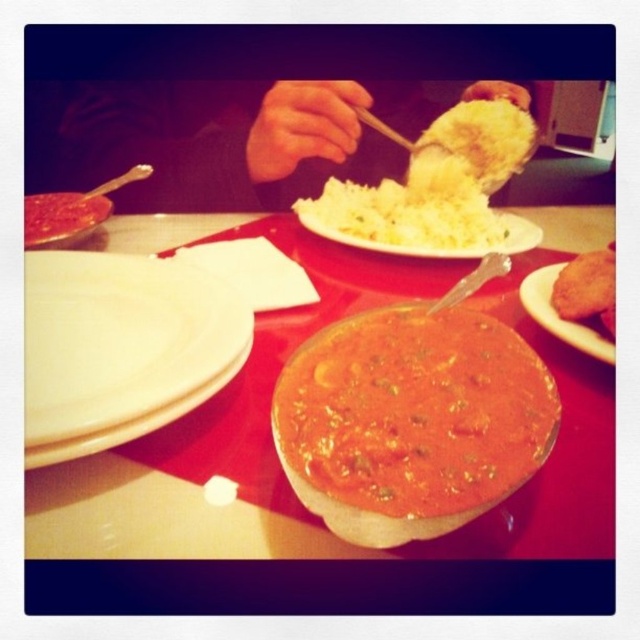
Question: Which of the following is the farthest from the observer?

Choices:
 (A) matte white plate at left
 (B) matte ceramic bowl at center
 (C) white matte plate at lower left
 (D) golden crispy fried chicken at right

Answer: (A)

Question: Does golden crispy fried chicken at right have a lesser width compared to matte white plate at center-right?

Choices:
 (A) no
 (B) yes

Answer: (A)

Question: From the image, what is the correct spatial relationship of yellow fluffy rice at upper center in relation to white matte plate at center?

Choices:
 (A) left
 (B) right

Answer: (B)

Question: Can you confirm if matte ceramic bowl at center is positioned to the right of golden crispy fried chicken at right?

Choices:
 (A) no
 (B) yes

Answer: (A)

Question: Which point is closer to the camera?

Choices:
 (A) (509, 148)
 (B) (609, 314)
 (C) (564, 321)

Answer: (B)

Question: Which object appears farthest from the camera in this image?

Choices:
 (A) matte ceramic bowl at center
 (B) matte white plate at center-right
 (C) yellow fluffy rice at upper center

Answer: (C)